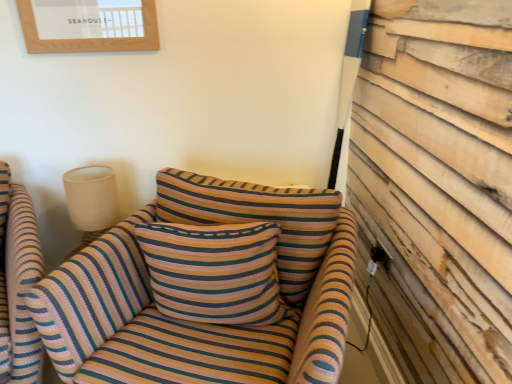
Question: Does striped fabric pillow at center come in front of striped fabric couch at center?

Choices:
 (A) yes
 (B) no

Answer: (B)

Question: Does striped fabric pillow at center appear on the left side of striped fabric couch at center?

Choices:
 (A) yes
 (B) no

Answer: (A)

Question: From the image's perspective, does striped fabric pillow at center appear lower than striped fabric couch at center?

Choices:
 (A) no
 (B) yes

Answer: (A)

Question: Can you confirm if striped fabric pillow at center is thinner than striped fabric couch at center?

Choices:
 (A) yes
 (B) no

Answer: (A)

Question: Considering the relative positions of striped fabric pillow at center and striped fabric couch at center in the image provided, is striped fabric pillow at center behind striped fabric couch at center?

Choices:
 (A) yes
 (B) no

Answer: (A)

Question: Is striped fabric chair at left wider or thinner than striped fabric pillow at center?

Choices:
 (A) thin
 (B) wide

Answer: (B)

Question: From their relative heights in the image, would you say striped fabric chair at left is taller or shorter than striped fabric pillow at center?

Choices:
 (A) tall
 (B) short

Answer: (A)

Question: Considering their positions, is striped fabric chair at left located in front of or behind striped fabric pillow at center?

Choices:
 (A) front
 (B) behind

Answer: (A)

Question: Choose the correct answer: Is striped fabric chair at left inside striped fabric pillow at center or outside it?

Choices:
 (A) inside
 (B) outside

Answer: (B)

Question: Is striped fabric chair at left inside the boundaries of striped fabric couch at center, or outside?

Choices:
 (A) outside
 (B) inside

Answer: (A)

Question: Based on their positions, is striped fabric chair at left located to the left or right of striped fabric couch at center?

Choices:
 (A) left
 (B) right

Answer: (A)

Question: Is point coord(18,379) closer or farther from the camera than point coord(159,345)?

Choices:
 (A) closer
 (B) farther

Answer: (B)

Question: From the image's perspective, is striped fabric chair at left above or below striped fabric couch at center?

Choices:
 (A) above
 (B) below

Answer: (A)

Question: From a real-world perspective, is wooden framed picture at upper left physically located above or below beige fabric lampshade at upper left?

Choices:
 (A) above
 (B) below

Answer: (A)

Question: In terms of size, does wooden framed picture at upper left appear bigger or smaller than beige fabric lampshade at upper left?

Choices:
 (A) small
 (B) big

Answer: (A)